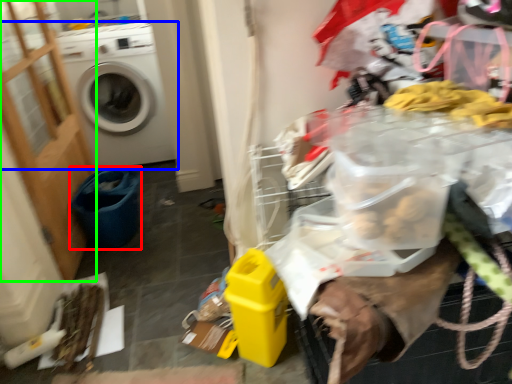
Question: Estimate the real-world distances between objects in this image. Which object is closer to recycling bin (highlighted by a red box), washing machine (highlighted by a blue box) or screen door (highlighted by a green box)?

Choices:
 (A) washing machine
 (B) screen door

Answer: (B)